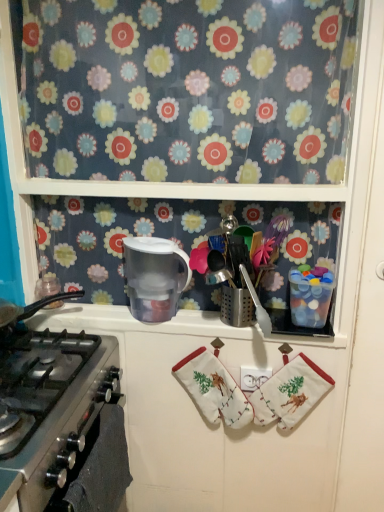
Question: From a real-world perspective, is transparent plastic pitcher at upper center, the 1th appliance positioned from the left, located higher than translucent plastic water filter at center?

Choices:
 (A) no
 (B) yes

Answer: (B)

Question: Is the position of transparent plastic pitcher at upper center, arranged as the 2th appliance when viewed from the right, more distant than that of translucent plastic water filter at center?

Choices:
 (A) yes
 (B) no

Answer: (B)

Question: Is transparent plastic pitcher at upper center, the 1th appliance positioned from the left, closer to the viewer compared to translucent plastic water filter at center?

Choices:
 (A) yes
 (B) no

Answer: (A)

Question: Considering the relative sizes of transparent plastic pitcher at upper center, the 1th appliance positioned from the left, and translucent plastic water filter at center in the image provided, is transparent plastic pitcher at upper center, the 1th appliance positioned from the left, taller than translucent plastic water filter at center?

Choices:
 (A) yes
 (B) no

Answer: (A)

Question: Is transparent plastic pitcher at upper center, the 1th appliance positioned from the left, thinner than translucent plastic water filter at center?

Choices:
 (A) yes
 (B) no

Answer: (B)

Question: Are transparent plastic pitcher at upper center, the 1th appliance positioned from the left, and translucent plastic water filter at center making contact?

Choices:
 (A) yes
 (B) no

Answer: (B)

Question: Is black matte oven at lower left at the right side of white cotton hand towel at center, which is the first hand towel from right to left?

Choices:
 (A) yes
 (B) no

Answer: (B)

Question: From a real-world perspective, is black matte oven at lower left physically below white cotton hand towel at center, which is the first hand towel from right to left?

Choices:
 (A) no
 (B) yes

Answer: (B)

Question: From the image's perspective, is black matte oven at lower left beneath white cotton hand towel at center, the second hand towel from the left?

Choices:
 (A) no
 (B) yes

Answer: (B)

Question: Are black matte oven at lower left and white cotton hand towel at center, the second hand towel from the left, beside each other?

Choices:
 (A) yes
 (B) no

Answer: (B)

Question: Does black matte oven at lower left have a greater height compared to white cotton hand towel at center, the second hand towel from the left?

Choices:
 (A) yes
 (B) no

Answer: (B)

Question: Is black matte oven at lower left thinner than white cotton hand towel at center, which is the first hand towel from right to left?

Choices:
 (A) no
 (B) yes

Answer: (B)

Question: Is white cotton hand towel at center, which ranks as the first hand towel in left-to-right order, at the back of floral fabric curtain at upper center?

Choices:
 (A) no
 (B) yes

Answer: (A)